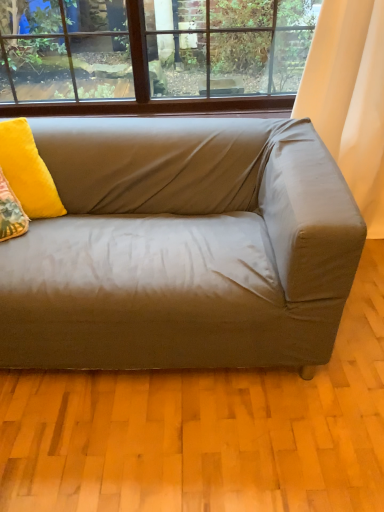
Question: In terms of width, does white fabric curtain at right look wider or thinner when compared to velvet yellow pillow at upper left?

Choices:
 (A) wide
 (B) thin

Answer: (B)

Question: From a real-world perspective, is white fabric curtain at right above or below velvet yellow pillow at upper left?

Choices:
 (A) above
 (B) below

Answer: (B)

Question: Which object is the farthest from the white fabric curtain at right?

Choices:
 (A) velvet yellow pillow at upper left
 (B) satin beige couch at center

Answer: (A)

Question: Estimate the real-world distances between objects in this image. Which object is closer to the velvet yellow pillow at upper left?

Choices:
 (A) satin beige couch at center
 (B) white fabric curtain at right

Answer: (A)